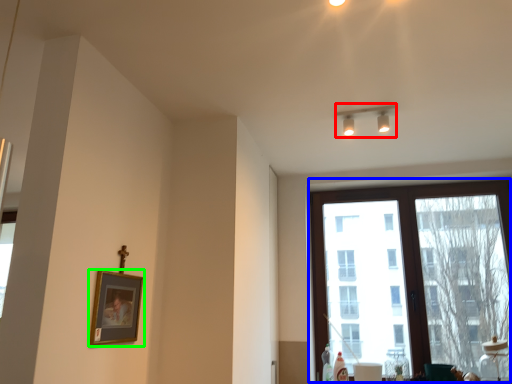
Question: Which object is positioned closest to lamp (highlighted by a red box)? Select from window (highlighted by a blue box) and picture frame (highlighted by a green box).

Choices:
 (A) window
 (B) picture frame

Answer: (A)